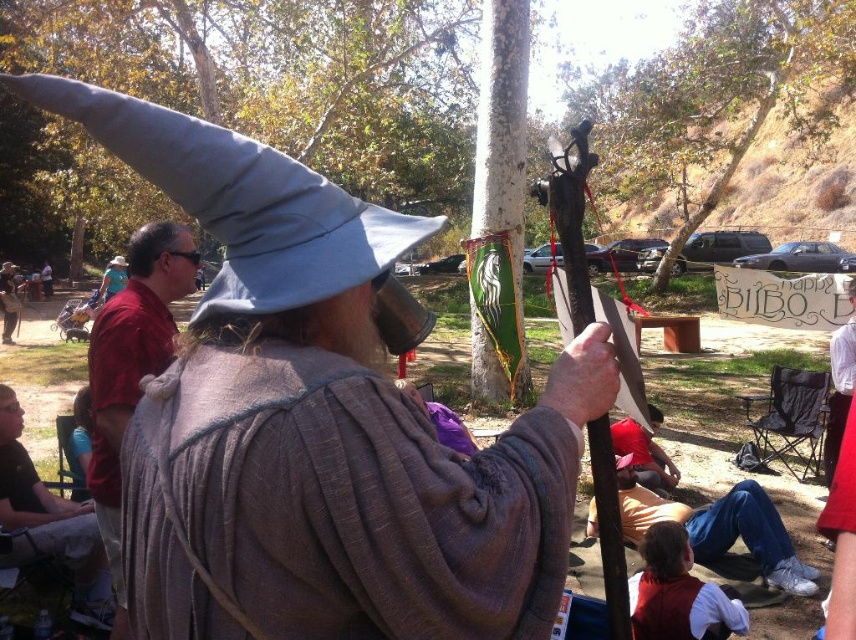
You are organizing a photo shoot and need to ensure that the matte red shirt at left and the brown leather jacket at lower left are visible in the frame. Given their sizes, which one should you focus on to ensure both are in the shot without cropping?

The matte red shirt at left is larger than the brown leather jacket at lower left, so focusing on the matte red shirt at left will help ensure both are visible in the frame without cropping.